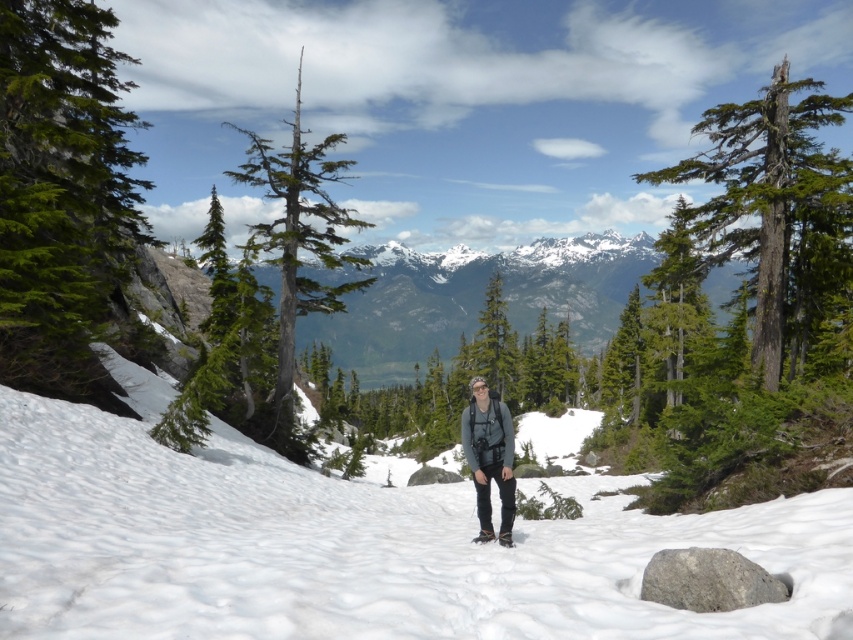
Is gray bark tree at center positioned at the back of gray fabric jacket at center?

Yes, gray bark tree at center is further from the viewer.

How far apart are gray bark tree at center and gray fabric jacket at center?

gray bark tree at center is 84.59 meters away from gray fabric jacket at center.

Which is behind, point (277, 410) or point (495, 406)?

Point (277, 410)

Locate an element on the screen. The image size is (853, 640). gray bark tree at center is located at coordinates (296, 248).

Can you confirm if gray bark tree at center is positioned above green textured tree at upper right?

Yes, gray bark tree at center is above green textured tree at upper right.

Is point (281, 388) closer to viewer compared to point (641, 387)?

Yes, point (281, 388) is in front of point (641, 387).

Is point (328, 209) positioned in front of point (688, 342)?

Yes, it is.

Image resolution: width=853 pixels, height=640 pixels. In order to click on gray bark tree at center in this screenshot , I will do `click(296, 248)`.

This screenshot has height=640, width=853. Describe the element at coordinates (62, 195) in the screenshot. I see `green coniferous tree at left` at that location.

In the scene shown: Does green coniferous tree at left have a smaller size compared to green textured tree at upper right?

Yes.

Is point (68, 240) positioned after point (688, 211)?

No, it is not.

Where is `green coniferous tree at left`? This screenshot has height=640, width=853. green coniferous tree at left is located at coordinates (62, 195).